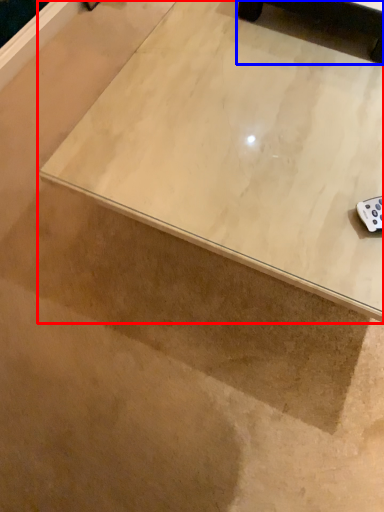
Question: Among these objects, which one is nearest to the camera, table (highlighted by a red box) or furniture (highlighted by a blue box)?

Choices:
 (A) table
 (B) furniture

Answer: (A)